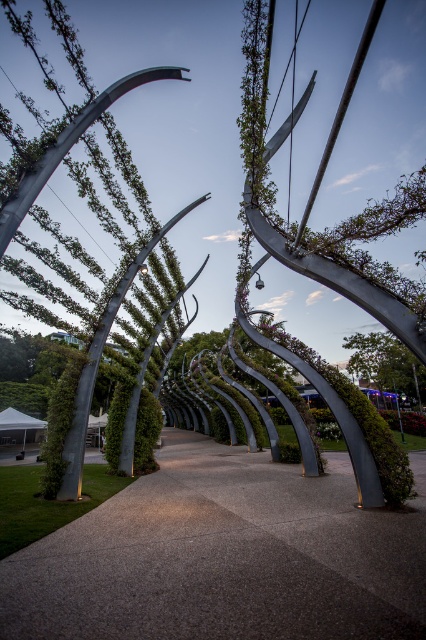
Is point (204, 200) positioned after point (365, 365)?

No.

Does green leafy arch at center appear on the right side of green leafy tree at lower right?

Incorrect, green leafy arch at center is not on the right side of green leafy tree at lower right.

Describe the element at coordinates (98, 362) in the screenshot. This screenshot has width=426, height=640. I see `green leafy arch at center` at that location.

The height and width of the screenshot is (640, 426). Identify the location of green leafy arch at center. (98, 362).

Is the position of concrete textured pathway at center less distant than that of green leafy arch at center?

Yes, concrete textured pathway at center is in front of green leafy arch at center.

Can you confirm if concrete textured pathway at center is positioned above green leafy arch at center?

No.

Locate an element on the screen. concrete textured pathway at center is located at coordinates pyautogui.click(x=224, y=556).

Image resolution: width=426 pixels, height=640 pixels. In order to click on concrete textured pathway at center in this screenshot , I will do `click(224, 556)`.

The width and height of the screenshot is (426, 640). What do you see at coordinates (224, 556) in the screenshot?
I see `concrete textured pathway at center` at bounding box center [224, 556].

What do you see at coordinates (224, 556) in the screenshot? I see `concrete textured pathway at center` at bounding box center [224, 556].

Where is `concrete textured pathway at center`? This screenshot has width=426, height=640. concrete textured pathway at center is located at coordinates (224, 556).